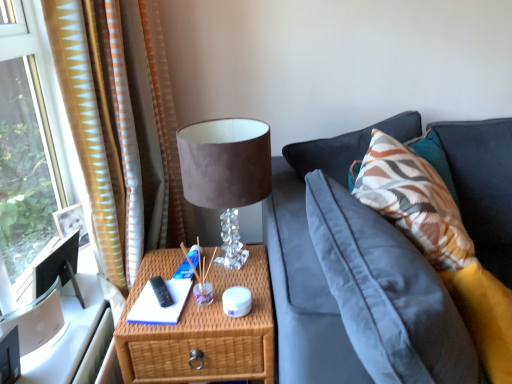
Question: Are white paper at center and suede-like brown table lamp at upper center making contact?

Choices:
 (A) no
 (B) yes

Answer: (A)

Question: Is white paper at center bigger than suede-like brown table lamp at upper center?

Choices:
 (A) yes
 (B) no

Answer: (B)

Question: Is white paper at center facing away from suede-like brown table lamp at upper center?

Choices:
 (A) no
 (B) yes

Answer: (A)

Question: Considering the relative positions of white paper at center and suede-like brown table lamp at upper center in the image provided, is white paper at center to the right of suede-like brown table lamp at upper center from the viewer's perspective?

Choices:
 (A) no
 (B) yes

Answer: (A)

Question: From a real-world perspective, does white paper at center sit lower than suede-like brown table lamp at upper center?

Choices:
 (A) yes
 (B) no

Answer: (A)

Question: Considering the relative sizes of white paper at center and suede-like brown table lamp at upper center in the image provided, is white paper at center thinner than suede-like brown table lamp at upper center?

Choices:
 (A) yes
 (B) no

Answer: (A)

Question: From a real-world perspective, is woven wood nightstand at lower center below white paper at center?

Choices:
 (A) yes
 (B) no

Answer: (A)

Question: Is there a large distance between woven wood nightstand at lower center and white paper at center?

Choices:
 (A) no
 (B) yes

Answer: (A)

Question: Is woven wood nightstand at lower center wider than white paper at center?

Choices:
 (A) yes
 (B) no

Answer: (A)

Question: Can you confirm if woven wood nightstand at lower center is taller than white paper at center?

Choices:
 (A) no
 (B) yes

Answer: (B)

Question: Does woven wood nightstand at lower center turn towards white paper at center?

Choices:
 (A) yes
 (B) no

Answer: (B)

Question: From the image's perspective, is woven wood nightstand at lower center under white paper at center?

Choices:
 (A) yes
 (B) no

Answer: (A)

Question: From the image's perspective, is suede-like brown table lamp at upper center over woven wood nightstand at lower center?

Choices:
 (A) yes
 (B) no

Answer: (A)